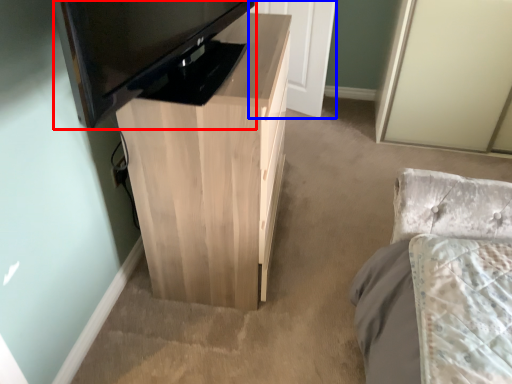
Question: Which point is further to the camera, television (highlighted by a red box) or door (highlighted by a blue box)?

Choices:
 (A) television
 (B) door

Answer: (B)